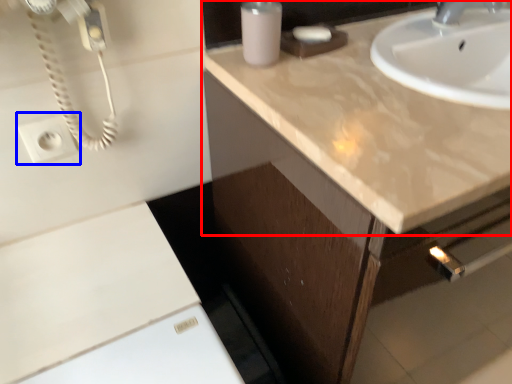
Question: Among these objects, which one is farthest to the camera, countertop (highlighted by a red box) or electric outlet (highlighted by a blue box)?

Choices:
 (A) countertop
 (B) electric outlet

Answer: (B)